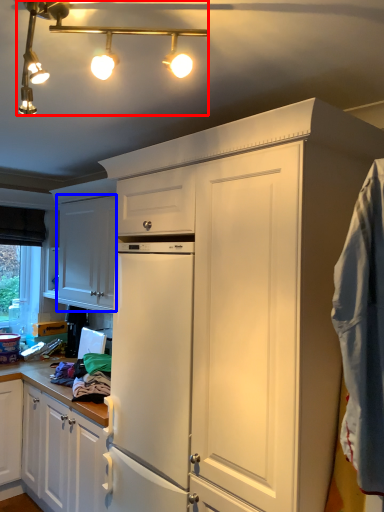
Question: Which object appears closest to the camera in this image, light fixture (highlighted by a red box) or cabinetry (highlighted by a blue box)?

Choices:
 (A) light fixture
 (B) cabinetry

Answer: (A)